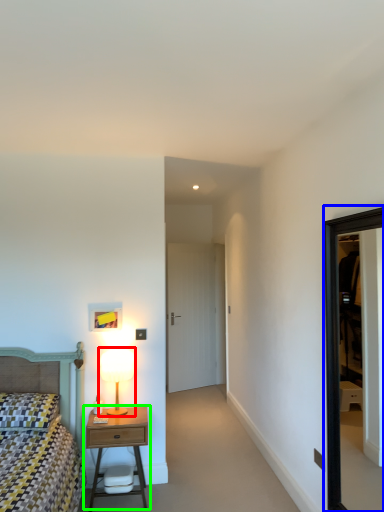
Question: Considering the real-world distances, which object is closest to table lamp (highlighted by a red box)? window (highlighted by a blue box) or nightstand (highlighted by a green box).

Choices:
 (A) window
 (B) nightstand

Answer: (B)